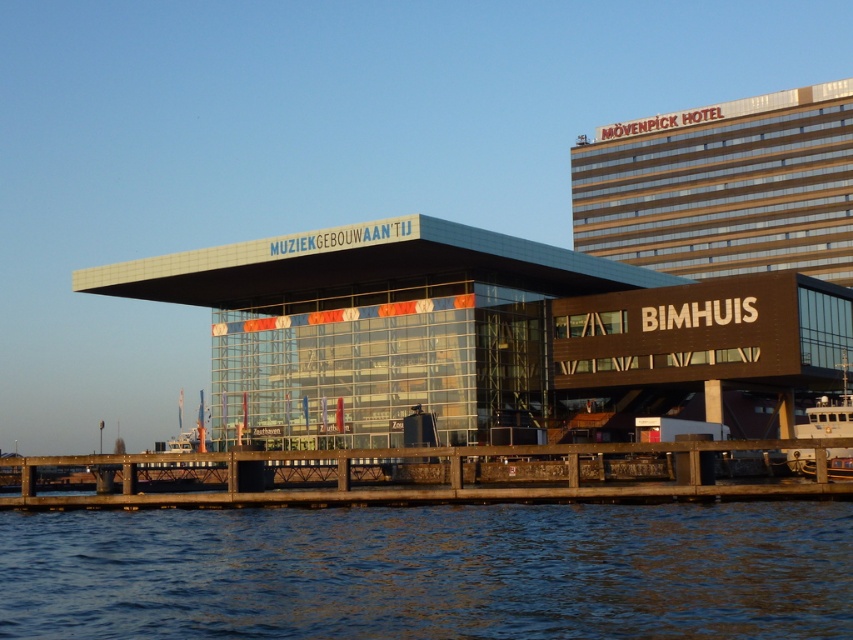
Question: Can you confirm if blue liquid water at lower center is smaller than gold reflective glass building at upper right?

Choices:
 (A) no
 (B) yes

Answer: (B)

Question: Does glassy modern building at center appear on the right side of gold reflective glass building at upper right?

Choices:
 (A) no
 (B) yes

Answer: (A)

Question: Which object appears closest to the camera in this image?

Choices:
 (A) brown wooden dock at lower center
 (B) gold reflective glass building at upper right
 (C) glassy modern building at center

Answer: (A)

Question: Which point is farther to the camera?

Choices:
 (A) (796, 573)
 (B) (473, 372)
 (C) (648, 445)
 (D) (672, 173)

Answer: (D)

Question: Which object is closer to the camera taking this photo?

Choices:
 (A) brown wooden dock at lower center
 (B) blue liquid water at lower center
 (C) gold reflective glass building at upper right
 (D) glassy modern building at center

Answer: (B)

Question: Can you confirm if glassy modern building at center is positioned above brown wooden dock at lower center?

Choices:
 (A) yes
 (B) no

Answer: (A)